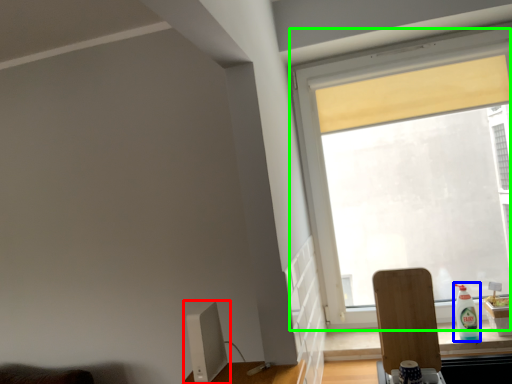
Question: Considering the real-world distances, which object is closest to computer monitor (highlighted by a red box)? bottle (highlighted by a blue box) or window (highlighted by a green box).

Choices:
 (A) bottle
 (B) window

Answer: (B)